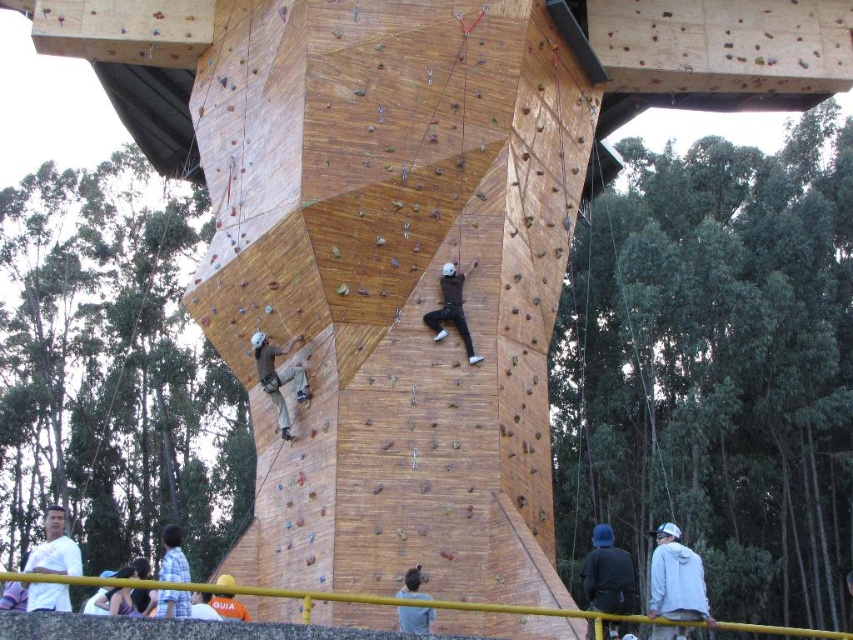
You are a photographer standing behind the yellow area. You need to take a photo of both the white matte jacket at lower right and the white matte shirt at lower left. Which object should you adjust your camera to focus on first if you want to capture both in the frame without moving your position?

You should focus on the white matte shirt at lower left first because the white matte jacket at lower right is to the right of it, so by centering the shirt, the jacket will naturally fall into the frame on the right side.

You are organizing an outdoor event and need to place two jackets on a narrow shelf. The shelf can only hold items up to the width of the dark blue jacket at center. Do you think the white matte jacket at lower right will fit on the shelf?

The white matte jacket at lower right is wider than the dark blue jacket at center, so it will not fit on the shelf which can only hold items up to the width of the dark blue jacket at center.